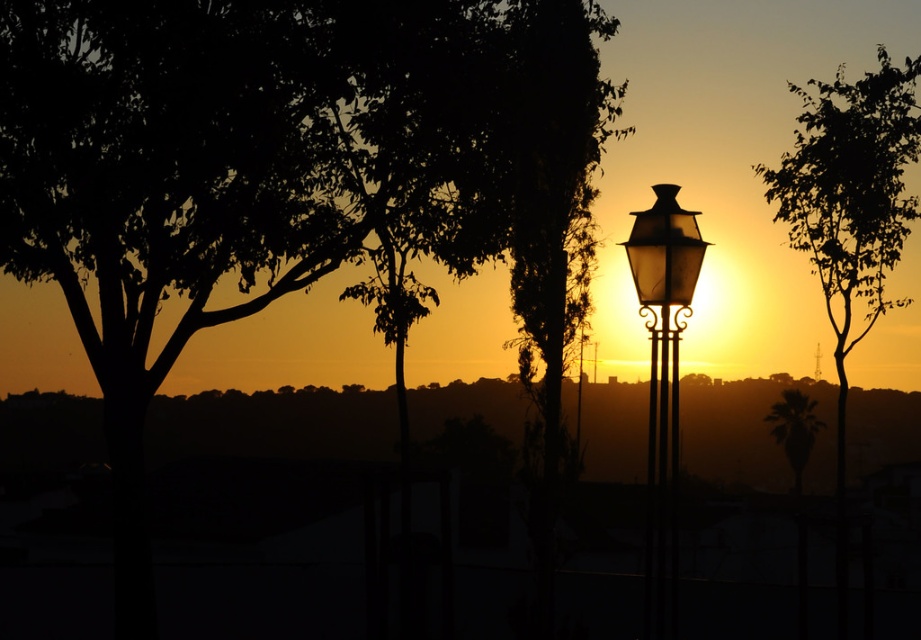
Does green leafy tree at upper right have a greater width compared to translucent glass street light at center?

Indeed, green leafy tree at upper right has a greater width compared to translucent glass street light at center.

Who is more forward, (906, 84) or (651, 211)?

Point (651, 211) is more forward.

Image resolution: width=921 pixels, height=640 pixels. Find the location of `green leafy tree at upper right`. green leafy tree at upper right is located at coordinates (850, 198).

Is green leafy tree at upper right taller than metallic lantern at center?

Yes.

Is point (845, 148) behind point (663, 243)?

Yes, point (845, 148) is farther from viewer.

Identify the location of green leafy tree at upper right. The image size is (921, 640). (850, 198).

Locate an element on the screen. Image resolution: width=921 pixels, height=640 pixels. translucent glass street light at center is located at coordinates click(x=663, y=250).

The width and height of the screenshot is (921, 640). Describe the element at coordinates (663, 250) in the screenshot. I see `translucent glass street light at center` at that location.

What do you see at coordinates (663, 250) in the screenshot? The height and width of the screenshot is (640, 921). I see `translucent glass street light at center` at bounding box center [663, 250].

The image size is (921, 640). Identify the location of translucent glass street light at center. (663, 250).